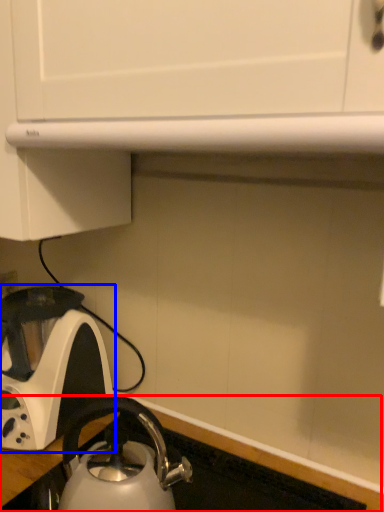
Question: Among these objects, which one is farthest to the camera, counter top (highlighted by a red box) or kettle (highlighted by a blue box)?

Choices:
 (A) counter top
 (B) kettle

Answer: (B)